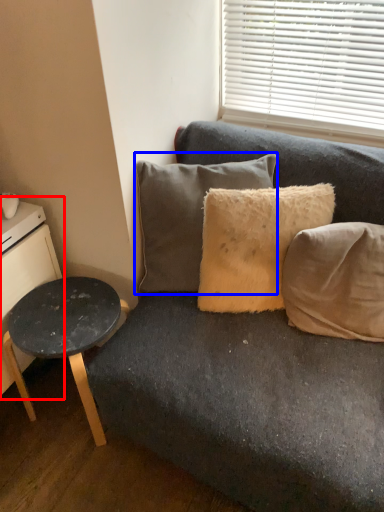
Question: Which object appears farthest to the camera in this image, dresser (highlighted by a red box) or pillow (highlighted by a blue box)?

Choices:
 (A) dresser
 (B) pillow

Answer: (B)